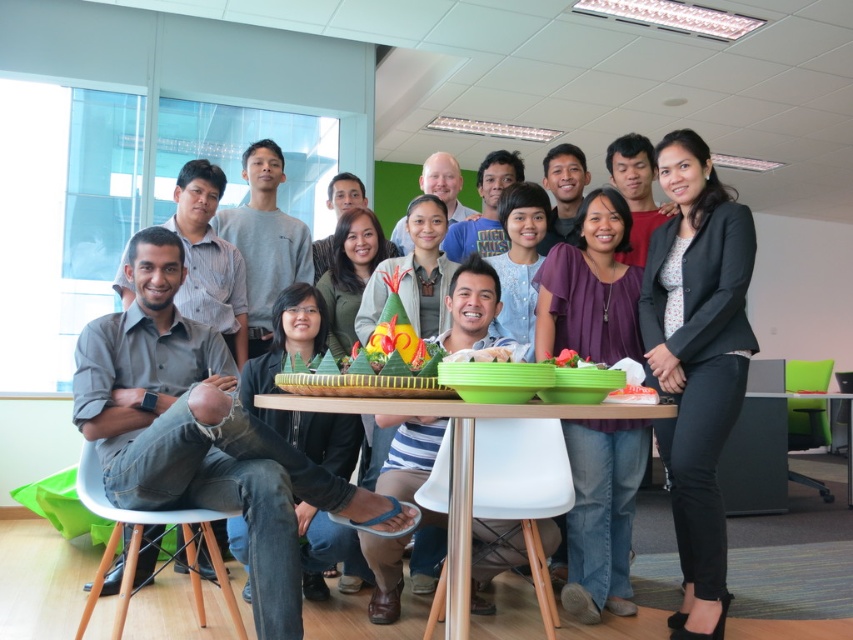
Does green plastic table at center appear on the left side of smooth plastic container at center?

Yes, green plastic table at center is to the left of smooth plastic container at center.

Can you confirm if green plastic table at center is thinner than smooth plastic container at center?

No, green plastic table at center is not thinner than smooth plastic container at center.

You are a GUI agent. You are given a task and a screenshot of the screen. Output one action in this format:
    pyautogui.click(x=<x>, y=<y>)
    Task: Click on the green plastic table at center
    The image size is (853, 640).
    Given the screenshot: What is the action you would take?
    pyautogui.click(x=457, y=460)

Which is behind, point (135, 548) or point (648, 394)?

The point (135, 548) is more distant.

Which of these two, white plastic stool at lower left or smooth plastic container at center, stands taller?

A: white plastic stool at lower left is taller.

Measure the distance between point (192,589) and camera.

Point (192,589) is 2.73 meters away from camera.

You are a GUI agent. You are given a task and a screenshot of the screen. Output one action in this format:
    pyautogui.click(x=<x>, y=<y>)
    Task: Click on the white plastic stool at lower left
    
    Given the screenshot: What is the action you would take?
    coord(186,557)

Can you confirm if matte black shirt at center is positioned to the left of black matte blazer at upper right?

Yes, matte black shirt at center is to the left of black matte blazer at upper right.

Who is positioned more to the right, matte black shirt at center or black matte blazer at upper right?

Positioned to the right is black matte blazer at upper right.

What do you see at coordinates (653, 387) in the screenshot? Image resolution: width=853 pixels, height=640 pixels. I see `matte black shirt at center` at bounding box center [653, 387].

The height and width of the screenshot is (640, 853). What are the coordinates of `matte black shirt at center` in the screenshot? It's located at (653, 387).